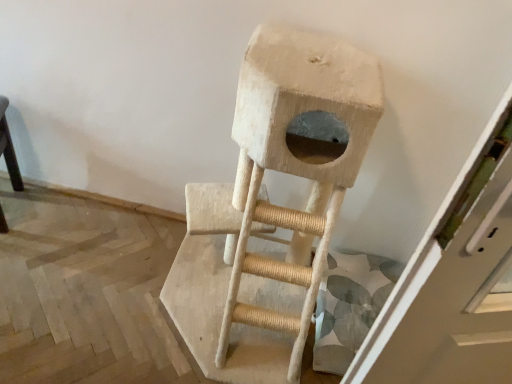
What do you see at coordinates (9, 148) in the screenshot? I see `smooth black table at left` at bounding box center [9, 148].

Find the location of a particular element. This screenshot has height=384, width=512. smooth black table at left is located at coordinates (9, 148).

What is the approximate width of smooth black table at left?

It is 13.46 inches.

Describe the element at coordinates (295, 162) in the screenshot. I see `natural wood cat tree at center` at that location.

Where is `natural wood cat tree at center`? natural wood cat tree at center is located at coordinates pyautogui.click(x=295, y=162).

The image size is (512, 384). I want to click on smooth black table at left, so click(9, 148).

Based on their positions, is smooth black table at left located to the left or right of natural wood cat tree at center?

smooth black table at left is to the left of natural wood cat tree at center.

Is smooth black table at left behind natural wood cat tree at center?

Yes, it is behind natural wood cat tree at center.

Is point (12, 185) positioned behind point (298, 353)?

Yes.

From the image's perspective, would you say smooth black table at left is positioned over natural wood cat tree at center?

Indeed, from the image's perspective, smooth black table at left is shown above natural wood cat tree at center.

From a real-world perspective, is smooth black table at left on natural wood cat tree at center?

Actually, smooth black table at left is physically below natural wood cat tree at center in the real world.

Which object is wider, smooth black table at left or natural wood cat tree at center?

Wider between the two is natural wood cat tree at center.

Based on the photo, considering the relative sizes of smooth black table at left and natural wood cat tree at center in the image provided, is smooth black table at left taller than natural wood cat tree at center?

No, smooth black table at left is not taller than natural wood cat tree at center.

Is smooth black table at left smaller than natural wood cat tree at center?

Yes.

Is natural wood cat tree at center located within smooth black table at left?

No, natural wood cat tree at center is not inside smooth black table at left.

Is smooth black table at left not close to natural wood cat tree at center?

Indeed, smooth black table at left is not near natural wood cat tree at center.

Is smooth black table at left turned away from natural wood cat tree at center?

That's not correct — smooth black table at left is not looking away from natural wood cat tree at center.

Looking at this image, how different are the orientations of smooth black table at left and natural wood cat tree at center in degrees?

20.2 degrees separate the facing orientations of smooth black table at left and natural wood cat tree at center.

At what (x,y) coordinates should I click in order to perform the action: click on ladder in front of the smooth black table at left. Please return your answer as a coordinate pair (x, y). This screenshot has height=384, width=512. Looking at the image, I should click on (295, 162).

Is natural wood cat tree at center at the right side of smooth black table at left?

Indeed, natural wood cat tree at center is positioned on the right side of smooth black table at left.

Considering the relative positions of natural wood cat tree at center and smooth black table at left in the image provided, is natural wood cat tree at center in front of smooth black table at left?

Yes, natural wood cat tree at center is closer to the viewer.

Considering the positions of points (266, 83) and (8, 147), is point (266, 83) farther from camera compared to point (8, 147)?

No.

From the image's perspective, is natural wood cat tree at center on smooth black table at left?

No, from the image's perspective, natural wood cat tree at center is not above smooth black table at left.

From a real-world perspective, between natural wood cat tree at center and smooth black table at left, who is vertically lower?

smooth black table at left is physically lower.

Does natural wood cat tree at center have a lesser width compared to smooth black table at left?

In fact, natural wood cat tree at center might be wider than smooth black table at left.

Between natural wood cat tree at center and smooth black table at left, which one has more height?

With more height is natural wood cat tree at center.

Considering the sizes of natural wood cat tree at center and smooth black table at left in the image, is natural wood cat tree at center bigger or smaller than smooth black table at left?

Clearly, natural wood cat tree at center is larger in size than smooth black table at left.

Is natural wood cat tree at center inside or outside of smooth black table at left?

The correct answer is: outside.

Is natural wood cat tree at center next to smooth black table at left and touching it?

No, natural wood cat tree at center is not touching smooth black table at left.

Is natural wood cat tree at center oriented away from smooth black table at left?

natural wood cat tree at center is not turned away from smooth black table at left.

What's the angular difference between natural wood cat tree at center and smooth black table at left's facing directions?

They differ by 20.2 degrees in their facing directions.

At what (x,y) coordinates should I click in order to perform the action: click on furniture below the natural wood cat tree at center (from a real-world perspective). Please return your answer as a coordinate pair (x, y). Image resolution: width=512 pixels, height=384 pixels. Looking at the image, I should click on (9, 148).

Locate an element on the screen. The width and height of the screenshot is (512, 384). ladder located in front of the smooth black table at left is located at coordinates (295, 162).

In the image, there is a smooth black table at left. What are the coordinates of `ladder below it (from the image's perspective)` in the screenshot? It's located at click(x=295, y=162).